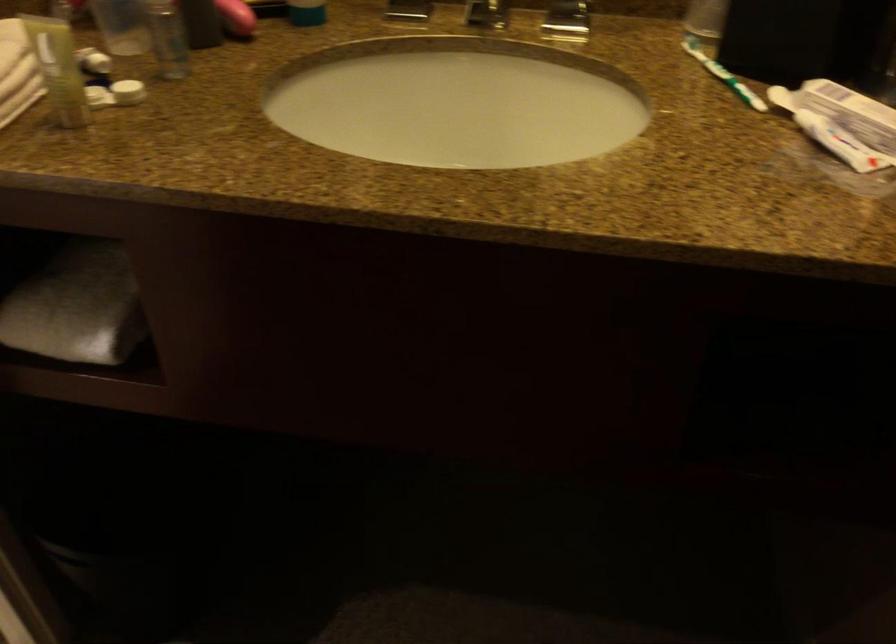
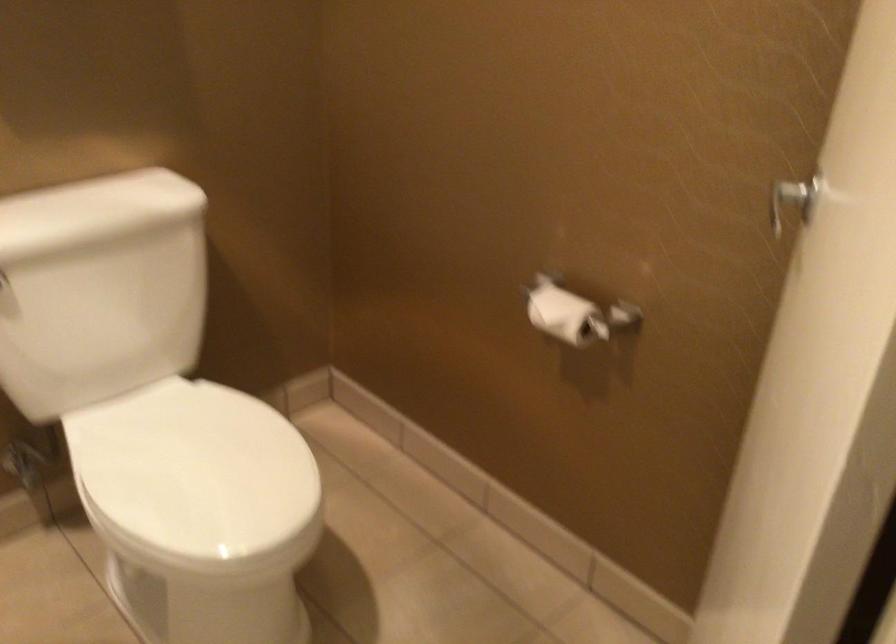
Question: The camera is either moving clockwise (left) or counter-clockwise (right) around the object. The first image is from the beginning of the video and the second image is from the end. Is the camera moving left or right when shooting the video?

Choices:
 (A) Left
 (B) Right

Answer: (B)